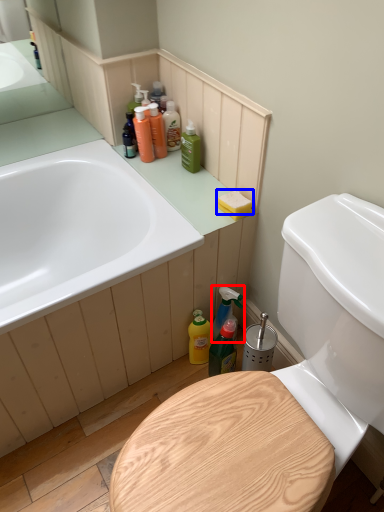
Question: Which point is closer to the camera, cleaning product (highlighted by a red box) or soap (highlighted by a blue box)?

Choices:
 (A) cleaning product
 (B) soap

Answer: (B)